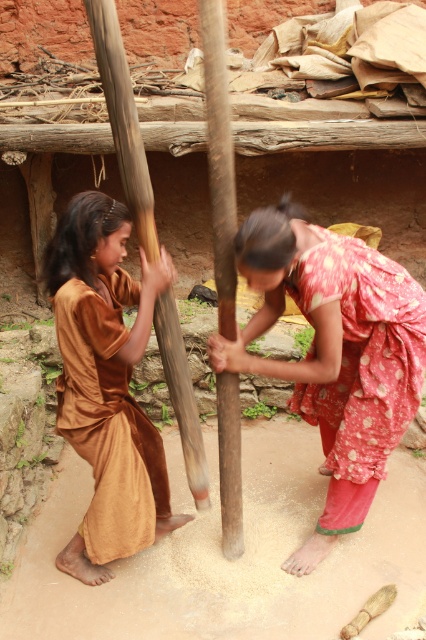
Question: Which of the following is the farthest from the observer?

Choices:
 (A) (299, 307)
 (B) (166, 269)

Answer: (A)

Question: Which point is farther from the camera taking this photo?

Choices:
 (A) (109, 576)
 (B) (308, 349)
 (C) (146, 248)

Answer: (B)

Question: Observing the image, what is the correct spatial positioning of polka dot fabric at center in reference to brown velvet dress at left?

Choices:
 (A) above
 (B) below

Answer: (A)

Question: Is polka dot fabric at center positioned at the back of brown wooden pole at left?

Choices:
 (A) no
 (B) yes

Answer: (B)

Question: Is polka dot fabric at center smaller than brown velvet dress at left?

Choices:
 (A) no
 (B) yes

Answer: (A)

Question: Which object is farther from the camera taking this photo?

Choices:
 (A) polka dot fabric at center
 (B) brown velvet dress at left
 (C) brown wooden pole at left

Answer: (B)